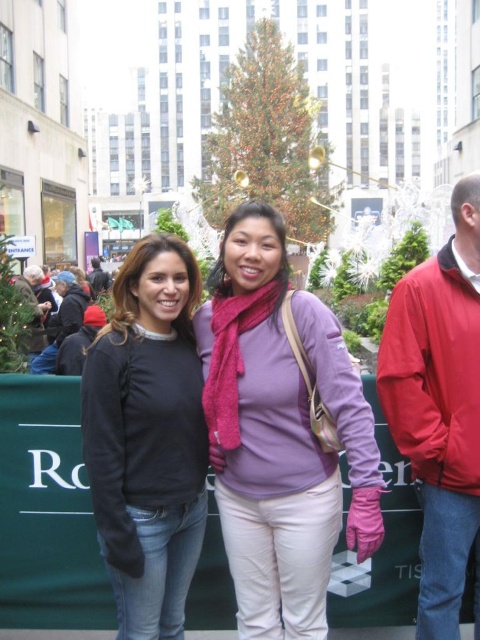
Question: Which point is farther to the camera?

Choices:
 (A) (433, 563)
 (B) (46, 308)

Answer: (B)

Question: Where is matte black sweater at center located in relation to brushed metal water at bottle left in the image?

Choices:
 (A) below
 (B) above

Answer: (A)

Question: Considering the real-world distances, which object is closest to the brushed metal water at bottle left?

Choices:
 (A) green textured christmas tree at center
 (B) blue denim jacket at left

Answer: (B)

Question: Can you confirm if red jacket at right is positioned to the left of green textured christmas tree at center?

Choices:
 (A) yes
 (B) no

Answer: (B)

Question: Does blue denim jacket at left have a smaller size compared to brushed metal water at bottle left?

Choices:
 (A) yes
 (B) no

Answer: (A)

Question: Which point appears closest to the camera in this image?

Choices:
 (A) (218, 323)
 (B) (28, 289)

Answer: (A)